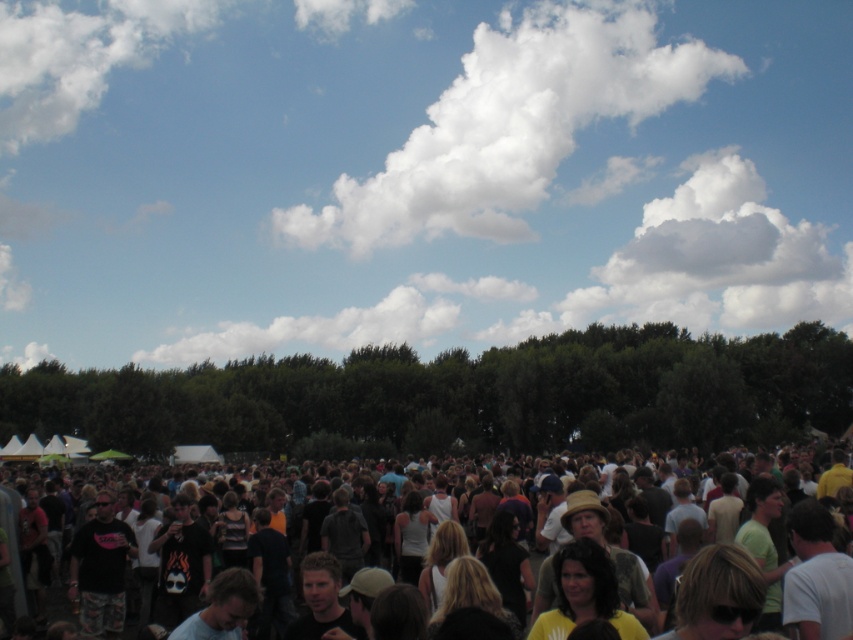
Who is shorter, white fluffy cloud at upper center or dark clothing crowd at center?

Standing shorter between the two is dark clothing crowd at center.

Who is higher up, white fluffy cloud at upper center or dark clothing crowd at center?

Positioned higher is white fluffy cloud at upper center.

Is point (508, 192) farther from viewer compared to point (363, 480)?

That is True.

Identify the location of white fluffy cloud at upper center. The image size is (853, 640). (509, 125).